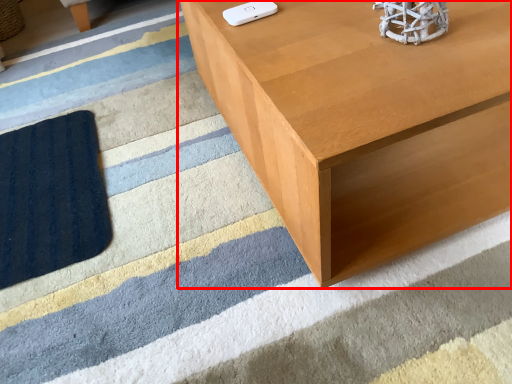
Question: Where is table (annotated by the red box) located in relation to Wii controller in the image?

Choices:
 (A) right
 (B) left

Answer: (A)